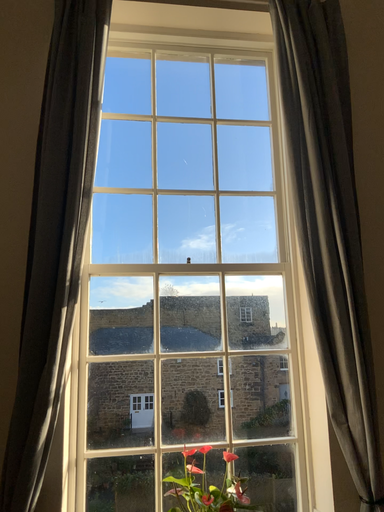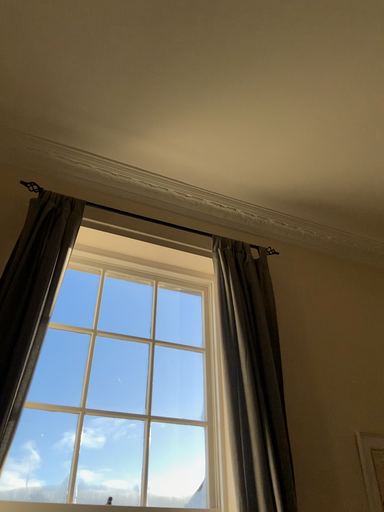
Question: How did the camera likely rotate when shooting the video?

Choices:
 (A) rotated downward
 (B) rotated upward

Answer: (B)